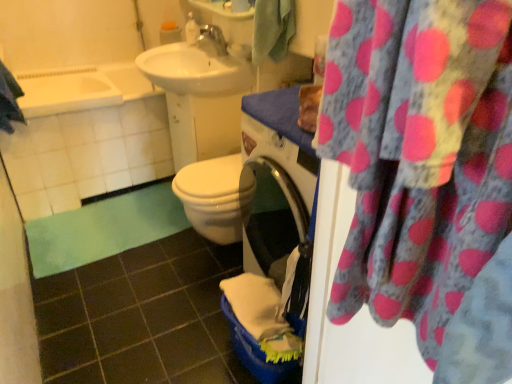
Question: Looking at their shapes, would you say blue textured towel at upper left, positioned as the second beach towel in right-to-left order, is wider or thinner than white glossy soap dispenser at upper center?

Choices:
 (A) thin
 (B) wide

Answer: (B)

Question: Does point (4, 125) appear closer or farther from the camera than point (188, 41)?

Choices:
 (A) closer
 (B) farther

Answer: (A)

Question: Which is farther from the pink polka dot fabric at upper right?

Choices:
 (A) silver metallic faucet at upper center
 (B) white glossy soap dispenser at upper center
 (C) green soft mat at lower left
 (D) white glossy sink at upper center
 (E) green fabric towel at upper center, marked as the 1th beach towel in a right-to-left arrangement

Answer: (B)

Question: Based on their relative distances, which object is farther from the pink polka dot fabric at upper right?

Choices:
 (A) white glossy soap dispenser at upper center
 (B) white glossy bathtub at upper left
 (C) white glossy sink at upper center
 (D) green soft mat at lower left
 (E) silver metallic faucet at upper center

Answer: (B)